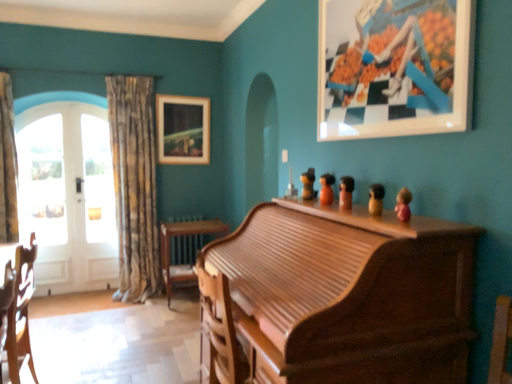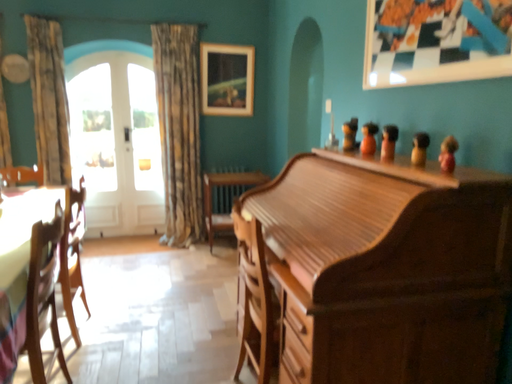
Question: Which way did the camera rotate in the video?

Choices:
 (A) rotated left
 (B) rotated right

Answer: (A)